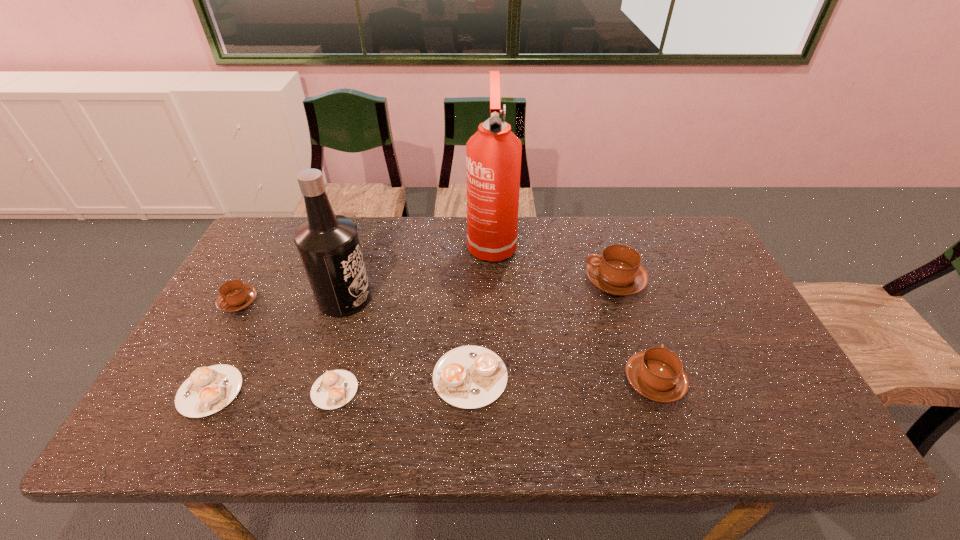
In order to click on the tallest object in this screenshot , I will do `click(493, 154)`.

This screenshot has width=960, height=540. I want to click on fire extinguisher, so click(493, 154).

At what (x,y) coordinates should I click in order to perform the action: click on the second tallest object. Please return your answer as a coordinate pair (x, y). Looking at the image, I should click on click(328, 244).

The image size is (960, 540). What are the coordinates of `liquor` in the screenshot? It's located at (328, 244).

Where is `the tallest cappuccino`? the tallest cappuccino is located at coordinates (617, 271).

This screenshot has width=960, height=540. What are the coordinates of `the third tallest object` in the screenshot? It's located at (617, 271).

The height and width of the screenshot is (540, 960). Find the location of `the fifth shortest cappuccino`. the fifth shortest cappuccino is located at coordinates (657, 374).

In order to click on the second biggest brown cappuccino in this screenshot , I will do `click(657, 374)`.

Where is `the smallest brown cappuccino`? The height and width of the screenshot is (540, 960). the smallest brown cappuccino is located at coordinates (235, 296).

Find the location of a particular element. This screenshot has width=960, height=540. the third tallest cappuccino is located at coordinates (235, 296).